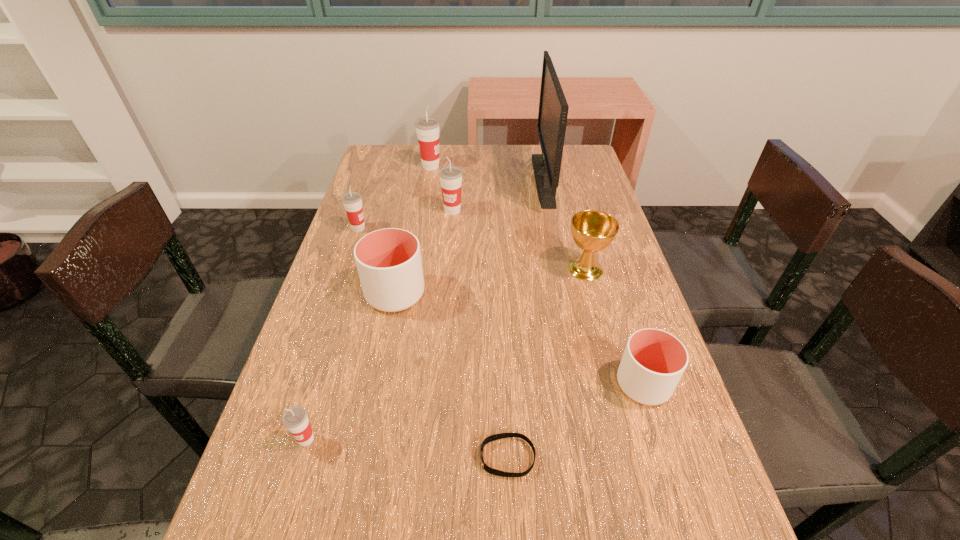
Find the location of a particular element. free space that satisfies the following two spatial constraints: 1. on the front-facing side of the monitor; 2. on the back side of the smaller white cup is located at coordinates (585, 384).

Identify the location of vacant space that satisfies the following two spatial constraints: 1. on the front-facing side of the gold chalice; 2. on the right side of the monitor. The image size is (960, 540). (562, 269).

At what (x,y) coordinates should I click in order to perform the action: click on free location that satisfies the following two spatial constraints: 1. on the front-facing side of the chalice; 2. on the left side of the monitor. Please return your answer as a coordinate pair (x, y). The width and height of the screenshot is (960, 540). Looking at the image, I should click on (562, 269).